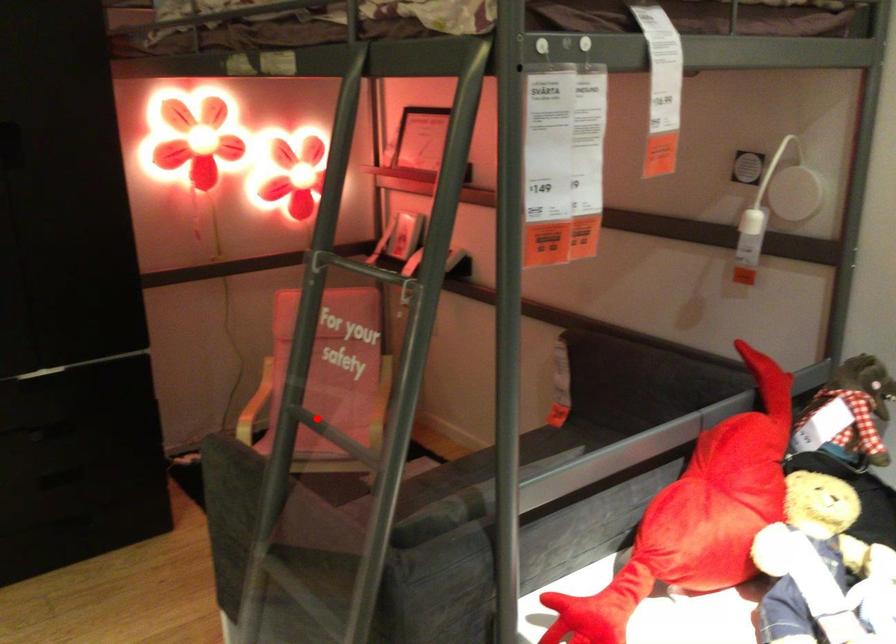
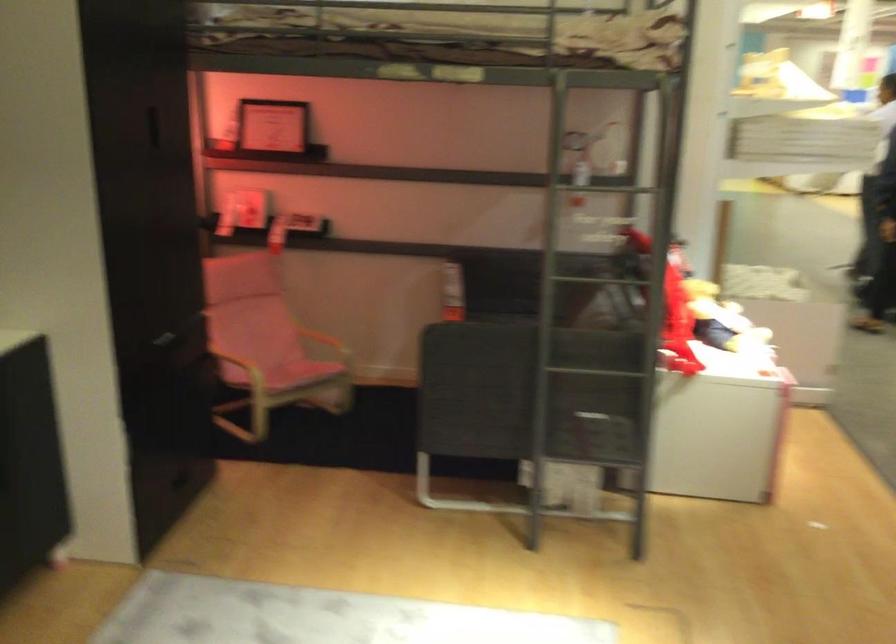
Locate, in the second image, the point that corresponds to the highlighted location in the first image.

(591, 278)